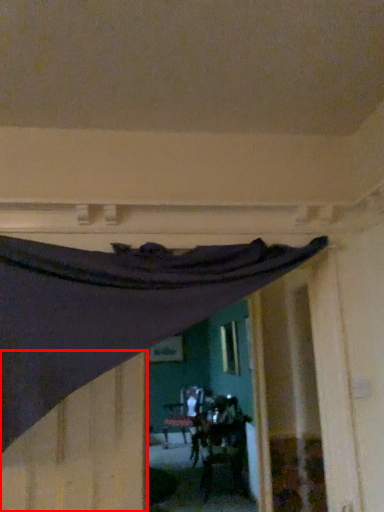
Question: From the image's perspective, what is the correct spatial positioning of plywood (annotated by the red box) in reference to curtain?

Choices:
 (A) above
 (B) below

Answer: (B)